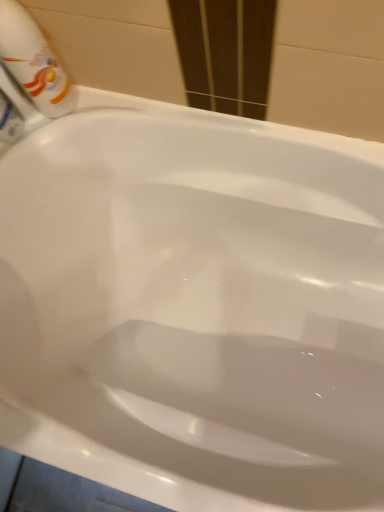
What are the coordinates of `matte white bottle at upper left` in the screenshot? It's located at (33, 62).

Describe the element at coordinates (33, 62) in the screenshot. Image resolution: width=384 pixels, height=512 pixels. I see `matte white bottle at upper left` at that location.

Find the location of a particular element. matte white bottle at upper left is located at coordinates (33, 62).